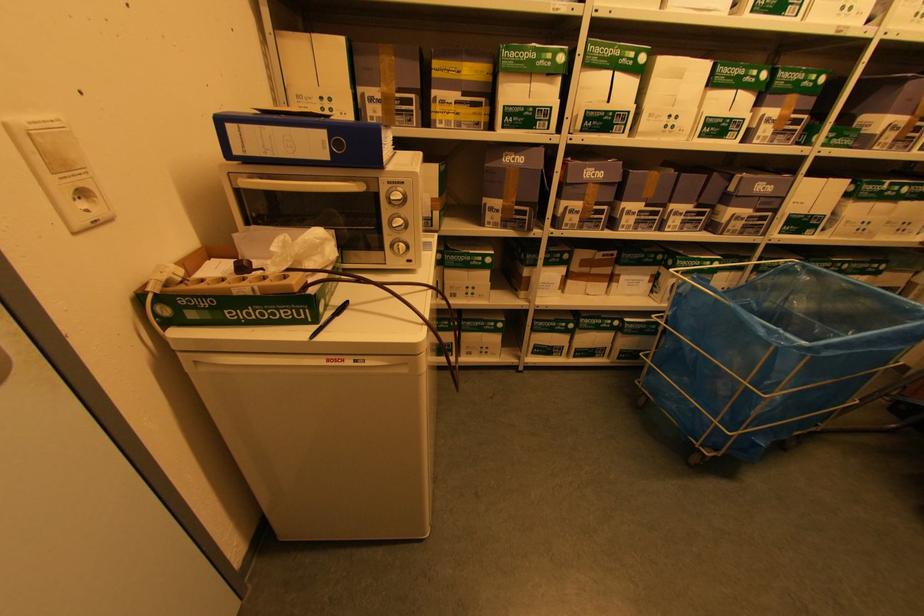
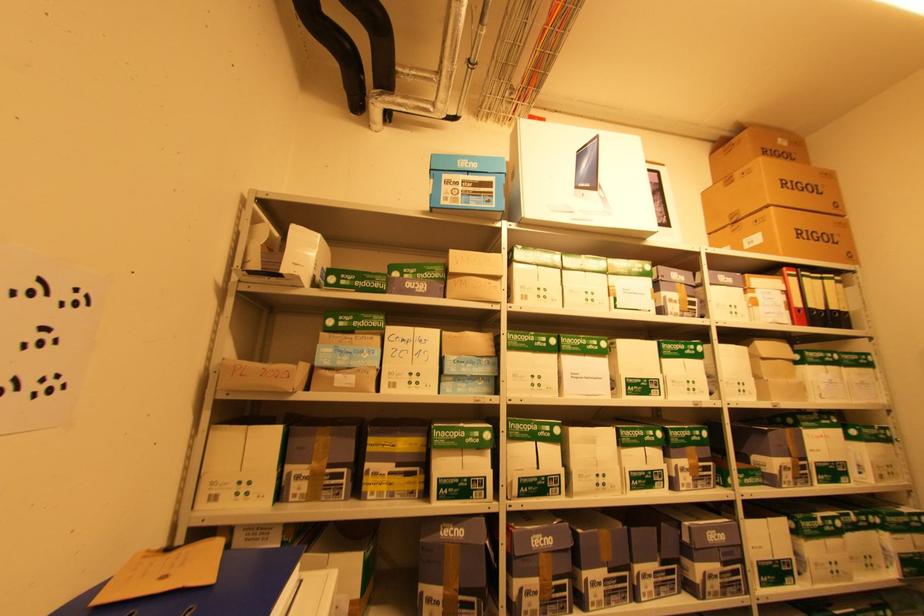
Question: Based on the continuous images, in which direction is the camera rotating? Reply with the corresponding letter.

Choices:
 (A) Left
 (B) Right
 (C) Up
 (D) Down

Answer: (C)